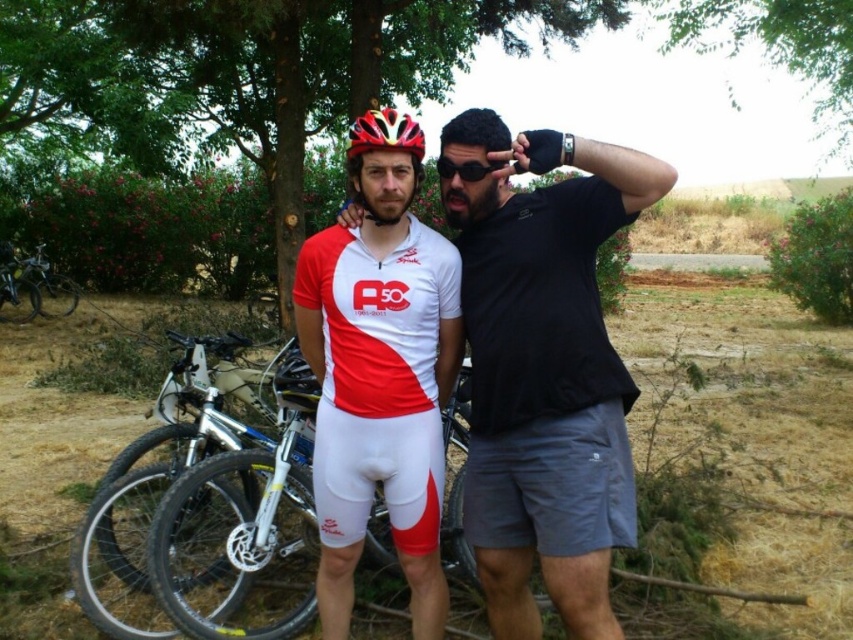
From the picture: Which is above, red matte helmet at center or shiny red helmet at center?

Positioned higher is shiny red helmet at center.

Which is more to the right, red matte helmet at center or shiny red helmet at center?

Positioned to the right is shiny red helmet at center.

What do you see at coordinates (383, 150) in the screenshot? The image size is (853, 640). I see `red matte helmet at center` at bounding box center [383, 150].

Find the location of a particular element. The height and width of the screenshot is (640, 853). red matte helmet at center is located at coordinates pos(383,150).

Is point (349, 264) in front of point (155, 508)?

Yes, it is in front of point (155, 508).

Between point (392, 310) and point (234, 616), which one is positioned in front?

Positioned in front is point (392, 310).

Describe the element at coordinates (379, 384) in the screenshot. I see `matte red and white cycling suit at center` at that location.

The image size is (853, 640). What are the coordinates of `matte red and white cycling suit at center` in the screenshot? It's located at [379, 384].

Who is positioned more to the left, shiny red helmet at center or black matte sunglasses at center?

shiny red helmet at center is more to the left.

Is shiny red helmet at center bigger than black matte sunglasses at center?

Yes.

Which is behind, point (354, 131) or point (479, 173)?

The point (354, 131) is more distant.

This screenshot has height=640, width=853. I want to click on shiny red helmet at center, so click(x=384, y=132).